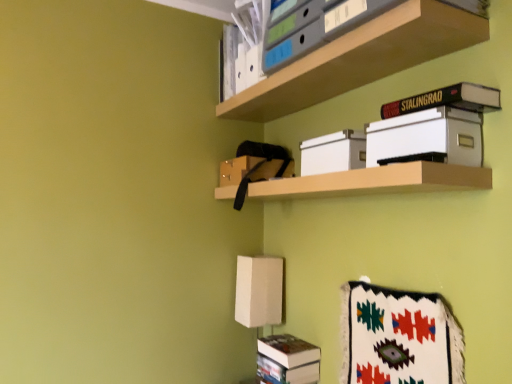
This screenshot has width=512, height=384. Find the location of `free space above white woven blanket at lower right (from a real-world perspective)`. free space above white woven blanket at lower right (from a real-world perspective) is located at coordinates (399, 284).